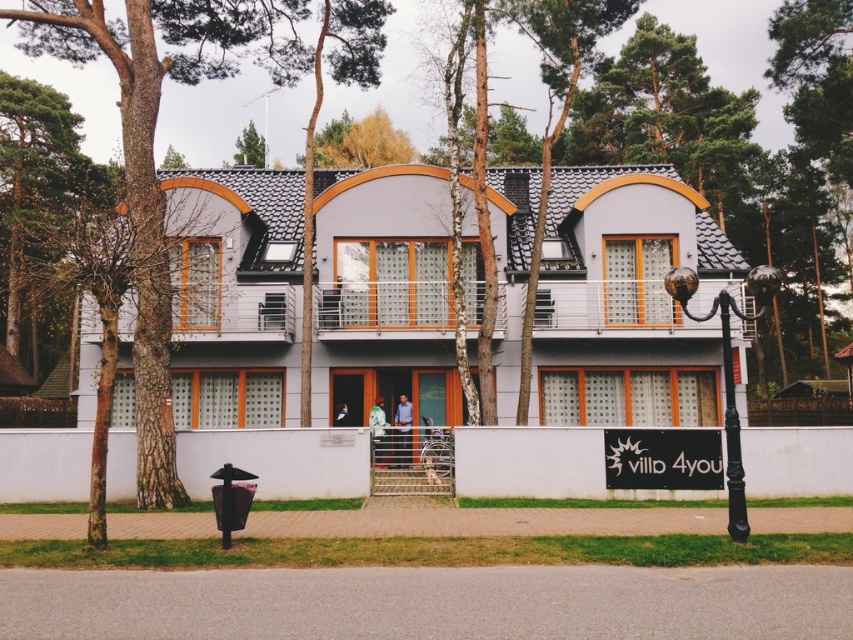
Measure the distance between blue shirt at center and blue fabric shirt at center.

blue shirt at center is 1.17 meters from blue fabric shirt at center.

Who is positioned more to the left, blue shirt at center or blue fabric shirt at center?

blue fabric shirt at center is more to the left.

The height and width of the screenshot is (640, 853). What do you see at coordinates (403, 429) in the screenshot? I see `blue shirt at center` at bounding box center [403, 429].

Where is `blue shirt at center`? blue shirt at center is located at coordinates (403, 429).

Is green fabric jacket at center below blue fabric shirt at center?

Indeed, green fabric jacket at center is positioned under blue fabric shirt at center.

Is point (370, 420) closer to viewer compared to point (339, 403)?

Yes, point (370, 420) is in front of point (339, 403).

Locate an element on the screen. Image resolution: width=853 pixels, height=640 pixels. green fabric jacket at center is located at coordinates click(x=376, y=429).

Based on the photo, does blue shirt at center have a lesser height compared to green fabric jacket at center?

Yes, blue shirt at center is shorter than green fabric jacket at center.

Between blue shirt at center and green fabric jacket at center, which one is positioned lower?

green fabric jacket at center is below.

Identify the location of blue shirt at center. This screenshot has height=640, width=853. (403, 429).